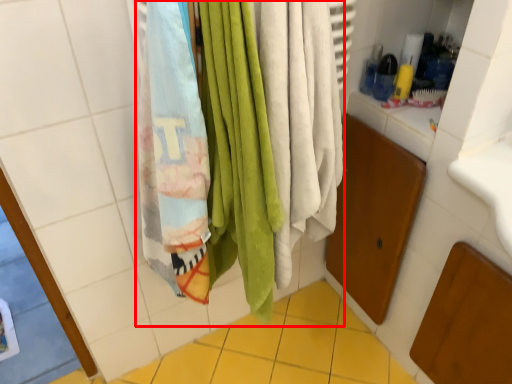
Question: From the image's perspective, where is beach towel (annotated by the red box) located relative to ceramic tile?

Choices:
 (A) above
 (B) below

Answer: (A)